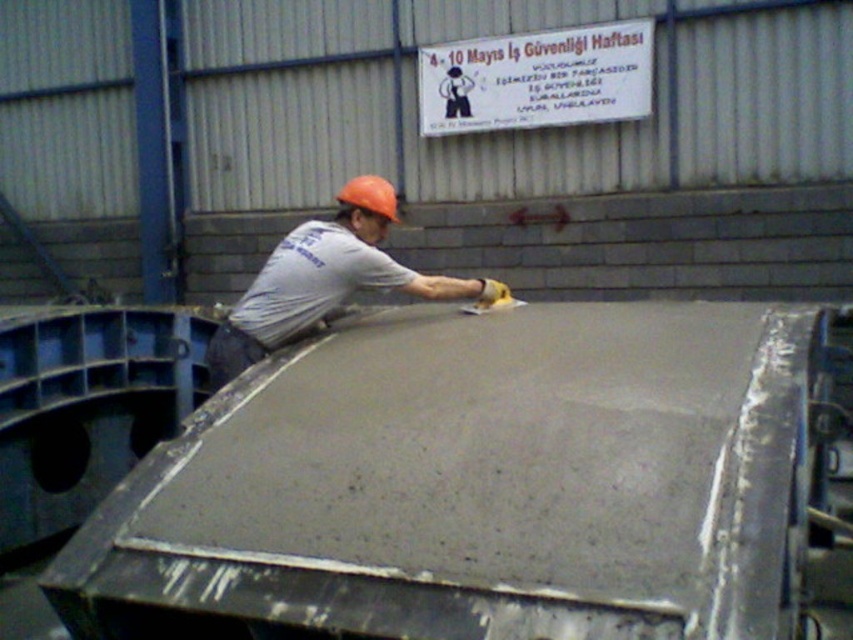
Question: Is smooth concrete at center below matte gray shirt at center?

Choices:
 (A) yes
 (B) no

Answer: (A)

Question: Does smooth concrete at center appear on the left side of matte gray shirt at center?

Choices:
 (A) yes
 (B) no

Answer: (B)

Question: Observing the image, what is the correct spatial positioning of smooth concrete at center in reference to matte gray shirt at center?

Choices:
 (A) below
 (B) above

Answer: (A)

Question: Which point is closer to the camera?

Choices:
 (A) (498, 284)
 (B) (547, 406)

Answer: (B)

Question: Among these objects, which one is nearest to the camera?

Choices:
 (A) matte gray shirt at center
 (B) smooth concrete at center

Answer: (B)